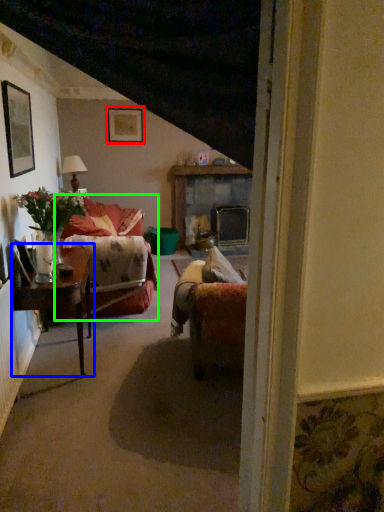
Question: Estimate the real-world distances between objects in this image. Which object is closer to picture frame (highlighted by a red box), table (highlighted by a blue box) or couch (highlighted by a green box)?

Choices:
 (A) table
 (B) couch

Answer: (B)